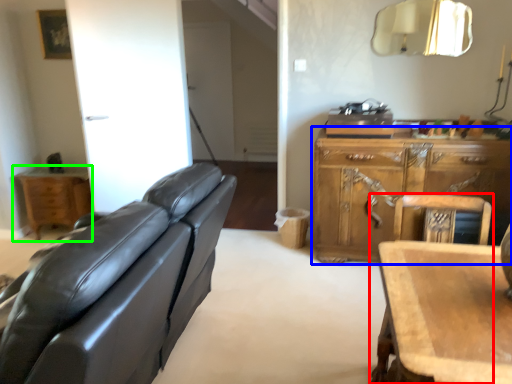
Question: Estimate the real-world distances between objects in this image. Which object is closer to chair (highlighted by a red box), cabinetry (highlighted by a blue box) or nightstand (highlighted by a green box)?

Choices:
 (A) cabinetry
 (B) nightstand

Answer: (A)